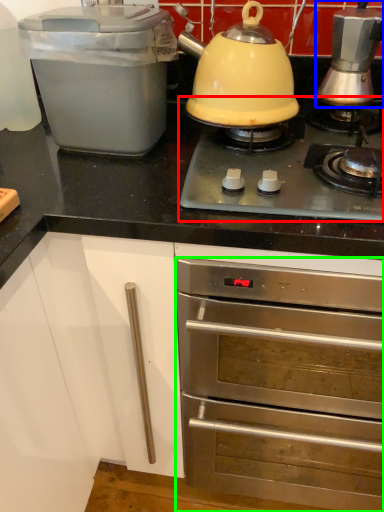
Question: Based on their relative distances, which object is farther from gas stove (highlighted by a red box)? Choose from kitchen appliance (highlighted by a blue box) and oven (highlighted by a green box).

Choices:
 (A) kitchen appliance
 (B) oven

Answer: (B)